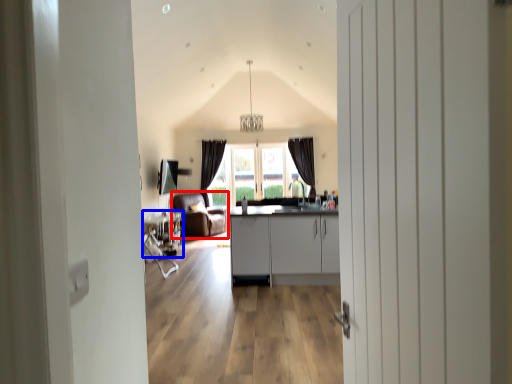
Question: Which object appears closest to the camera in this image, armchair (highlighted by a red box) or table (highlighted by a blue box)?

Choices:
 (A) armchair
 (B) table

Answer: (B)